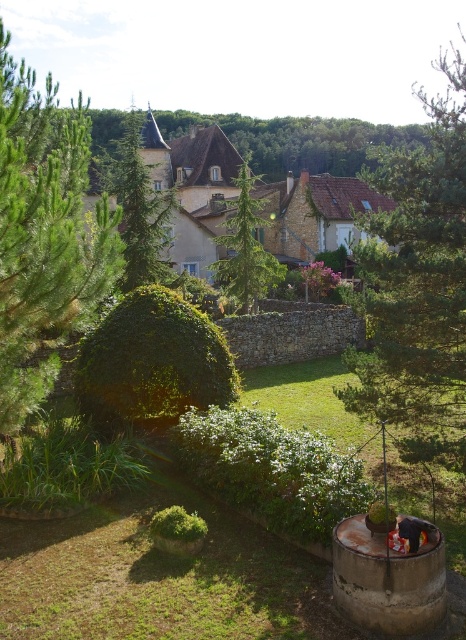
You are standing at the camera position and want to take a photo of the green leafy tree at center. If your camera has a maximum focus range of 40 feet, will you be able to capture the tree in focus?

The green leafy tree at center and camera are 43.22 feet apart from each other. Since the distance exceeds the camera maximum focus range of 40 feet, the tree will be out of focus.

You are a landscape architect designing a new garden layout. You need to place a statue between the green leafy tree at center and the green leafy tree at upper center. Which tree should the statue be closer to if you want it to be proportionally balanced with their sizes?

The statue should be closer to the green leafy tree at center because it is smaller than the green leafy tree at upper center, so balancing their sizes would require the statue to be nearer to the smaller tree to maintain visual equilibrium.

In the scene shown: You are a gardener planning to trim both the green leafy tree at center and the green leafy tree at upper center. Based on their positions, which tree should you tackle first if you want to start from the lowest point and work your way up?

The green leafy tree at center should be tackled first because it is located below the green leafy tree at upper center, so starting from the lower one aligns with working from the lowest point upwards.